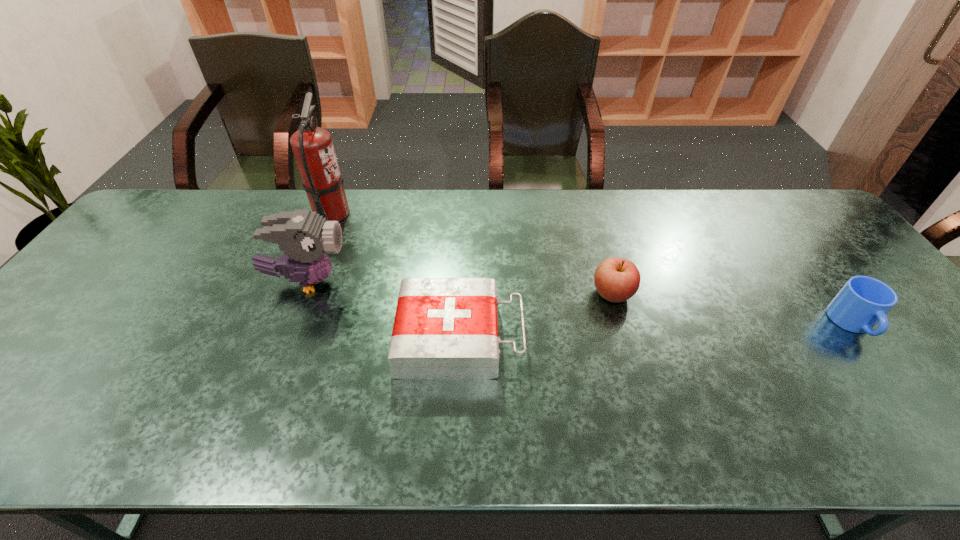
Where is `vacant space in between the shortest object and the apple`? vacant space in between the shortest object and the apple is located at coordinates (536, 315).

At what (x,y) coordinates should I click in order to perform the action: click on blank region between the farthest object and the apple. Please return your answer as a coordinate pair (x, y). Looking at the image, I should click on (472, 254).

The width and height of the screenshot is (960, 540). What are the coordinates of `free area in between the second object from right to left and the tallest object` in the screenshot? It's located at (472, 254).

Locate which object ranks second in proximity to the fourth object from left to right. Please provide its 2D coordinates. Your answer should be formatted as a tuple, i.e. [(x, y)], where the tuple contains the x and y coordinates of a point satisfying the conditions above.

[(863, 301)]

What are the coordinates of `object identified as the second closest to the bird` in the screenshot? It's located at (312, 146).

Where is `free space that satisfies the following two spatial constraints: 1. at the beak of the apple; 2. on the left side of the second tallest object`? free space that satisfies the following two spatial constraints: 1. at the beak of the apple; 2. on the left side of the second tallest object is located at coordinates (302, 294).

Locate an element on the screen. free location that satisfies the following two spatial constraints: 1. on the side of the rightmost object with the handle; 2. on the front side of the third object from left to right is located at coordinates (863, 337).

You are a GUI agent. You are given a task and a screenshot of the screen. Output one action in this format:
    pyautogui.click(x=<x>, y=<y>)
    Task: Click on the vacant position in the image that satisfies the following two spatial constraints: 1. at the beak of the second tallest object; 2. on the back side of the apple
    
    Given the screenshot: What is the action you would take?
    pyautogui.click(x=302, y=294)

Image resolution: width=960 pixels, height=540 pixels. Identify the location of free space that satisfies the following two spatial constraints: 1. on the side of the rightmost object with the handle; 2. on the front side of the first-aid kit. (863, 337).

Locate an element on the screen. Image resolution: width=960 pixels, height=540 pixels. vacant position in the image that satisfies the following two spatial constraints: 1. toward the nozzle of the fire extinguisher; 2. on the back side of the second object from right to left is located at coordinates (300, 294).